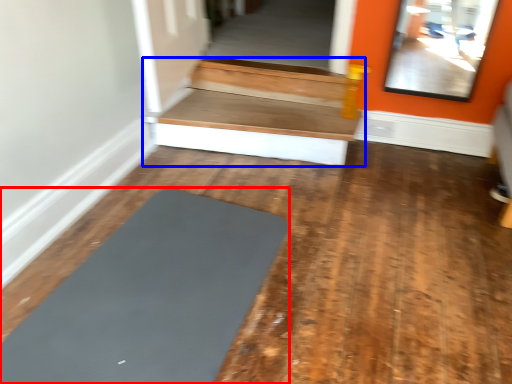
Question: Which object appears closest to the camera in this image, yoga (highlighted by a red box) or stairwell (highlighted by a blue box)?

Choices:
 (A) yoga
 (B) stairwell

Answer: (A)